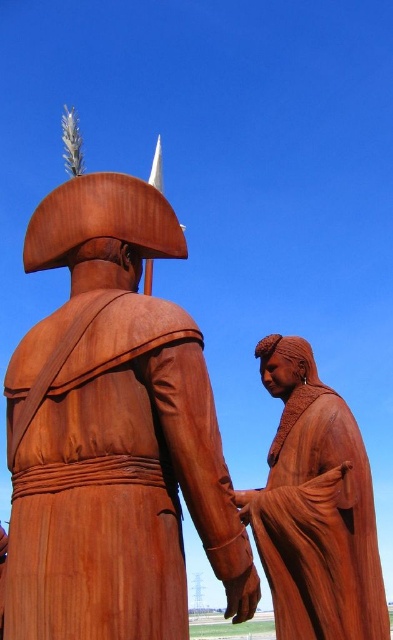
Question: In this image, where is rustic wood figure at center located relative to rusty metal hand at center?

Choices:
 (A) above
 (B) below

Answer: (A)

Question: Which point appears farthest from the camera in this image?

Choices:
 (A) pyautogui.click(x=244, y=584)
 (B) pyautogui.click(x=27, y=470)

Answer: (A)

Question: Which point is closer to the camera?

Choices:
 (A) rusty wood statue at left
 (B) rusty metal hand at center
 (C) rustic wood figure at center

Answer: (A)

Question: Considering the real-world distances, which object is farthest from the rusty wood statue at left?

Choices:
 (A) rusty metal hand at center
 (B) rustic wood figure at center

Answer: (A)

Question: Does rusty wood statue at left have a greater width compared to rustic wood figure at center?

Choices:
 (A) no
 (B) yes

Answer: (B)

Question: Can you confirm if rustic wood figure at center is bigger than rusty metal hand at center?

Choices:
 (A) no
 (B) yes

Answer: (B)